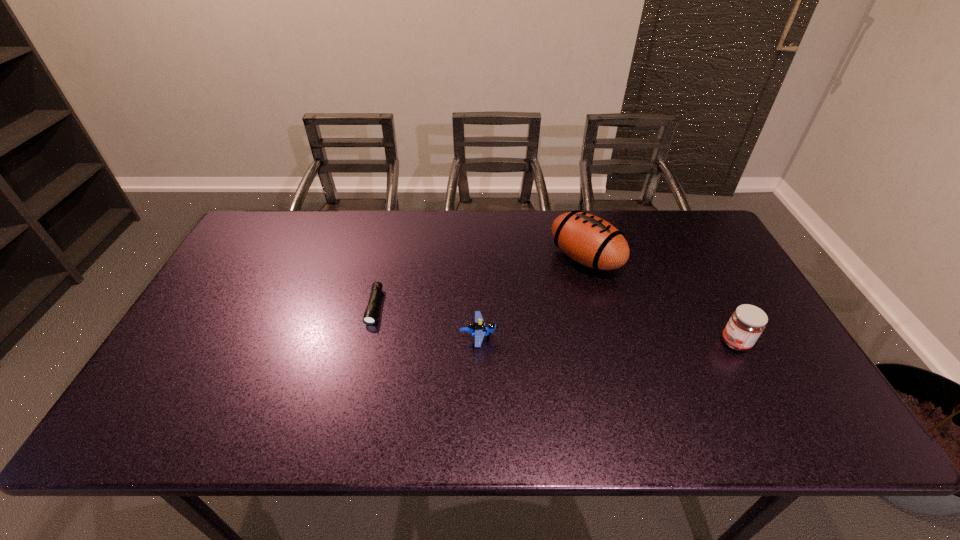
This screenshot has height=540, width=960. I want to click on free space that satisfies the following two spatial constraints: 1. on the front-facing side of the second tallest object; 2. on the right side of the third tallest object, so click(x=479, y=342).

Identify the location of vacant area that satisfies the following two spatial constraints: 1. on the front side of the jam; 2. on the right side of the third object from left to right. The image size is (960, 540). (608, 342).